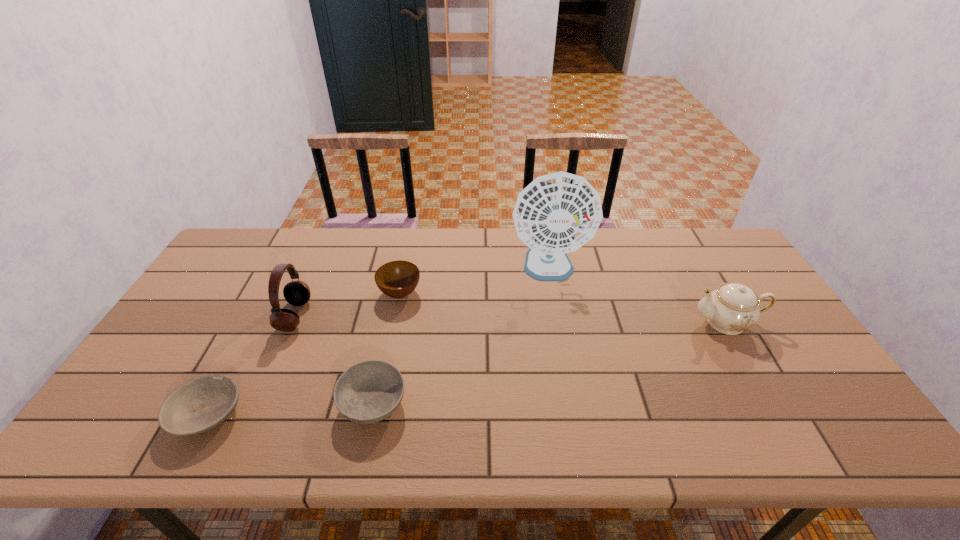
You are a GUI agent. You are given a task and a screenshot of the screen. Output one action in this format:
    pyautogui.click(x=<x>, y=<y>)
    Task: Click on the vacant space that is in between the farthest bowl and the chinaware
    The height and width of the screenshot is (540, 960).
    Given the screenshot: What is the action you would take?
    pyautogui.click(x=564, y=308)

At what (x,y) coordinates should I click in order to perform the action: click on blank region between the farthest bowl and the headset. Please return your answer as a coordinate pair (x, y). Image resolution: width=960 pixels, height=540 pixels. Looking at the image, I should click on (348, 305).

Choose which object is the second nearest neighbor to the second object from right to left. Please provide its 2D coordinates. Your answer should be formatted as a tuple, i.e. [(x, y)], where the tuple contains the x and y coordinates of a point satisfying the conditions above.

[(396, 279)]

At what (x,y) coordinates should I click in order to perform the action: click on object that is the third closest to the chinaware. Please return your answer as a coordinate pair (x, y). Looking at the image, I should click on (370, 391).

Identify the location of bowl identified as the closest to the farthest bowl. Image resolution: width=960 pixels, height=540 pixels. (370, 391).

Locate an element on the screen. This screenshot has height=540, width=960. the second closest bowl relative to the farthest bowl is located at coordinates (200, 404).